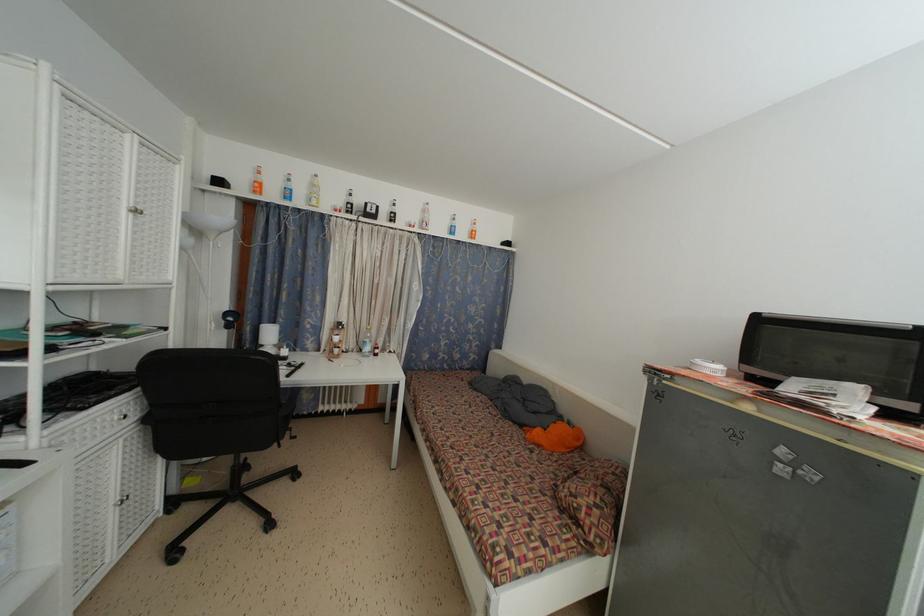
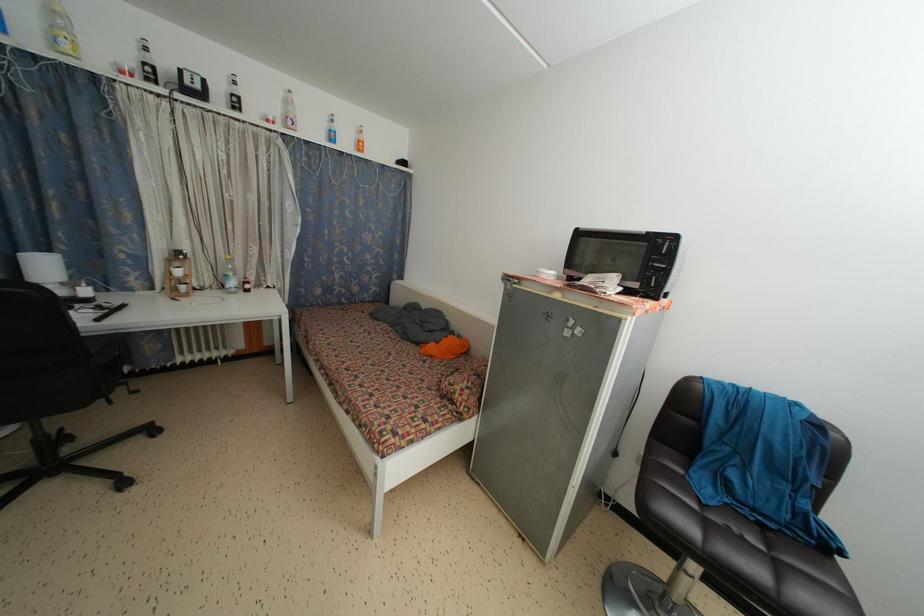
Find the pixel in the second image that matches (x=496, y=440) in the first image.

(394, 360)